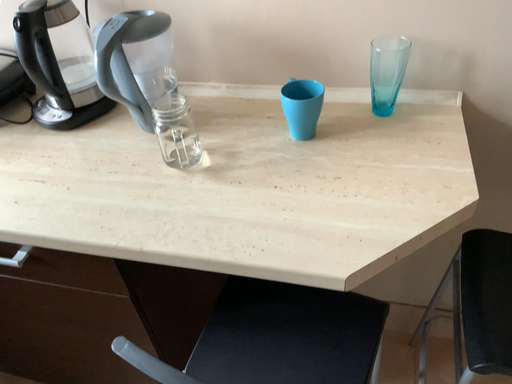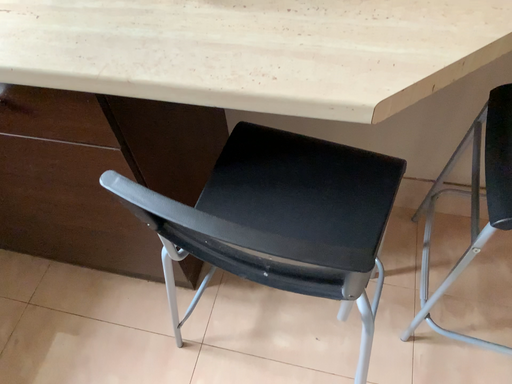
Question: Which way did the camera rotate in the video?

Choices:
 (A) rotated upward
 (B) rotated downward

Answer: (B)